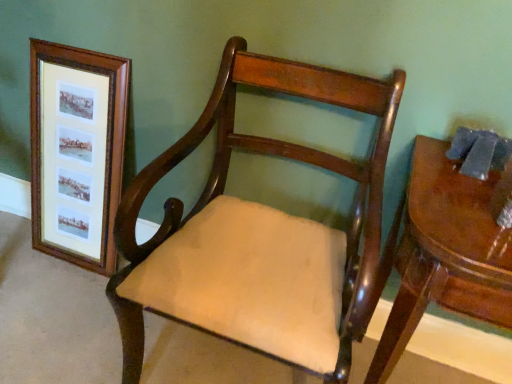
This screenshot has width=512, height=384. What do you see at coordinates (445, 253) in the screenshot? I see `glossy wood table at right` at bounding box center [445, 253].

What is the approximate width of wooden frame at left?

wooden frame at left is 2.32 inches in width.

Locate an element on the screen. This screenshot has width=512, height=384. mahogany wood chair at center is located at coordinates (262, 234).

What are the coordinates of `glossy wood table at right` in the screenshot? It's located at (445, 253).

From the image's perspective, would you say wooden frame at left is positioned over mahogany wood chair at center?

Yes, from the image's perspective, wooden frame at left is on top of mahogany wood chair at center.

Locate an element on the screen. The height and width of the screenshot is (384, 512). picture frame above the mahogany wood chair at center (from the image's perspective) is located at coordinates (77, 151).

Looking at the image, does wooden frame at left seem bigger or smaller compared to mahogany wood chair at center?

wooden frame at left is smaller than mahogany wood chair at center.

Are wooden frame at left and mahogany wood chair at center located far from each other?

No.

Considering the sizes of objects wooden frame at left and glossy wood table at right in the image provided, who is shorter, wooden frame at left or glossy wood table at right?

glossy wood table at right.

Which object is further away from the camera taking this photo, wooden frame at left or glossy wood table at right?

wooden frame at left is behind.

Visually, is wooden frame at left positioned to the left or to the right of glossy wood table at right?

Clearly, wooden frame at left is on the left of glossy wood table at right in the image.

Is glossy wood table at right located within wooden frame at left?

No, glossy wood table at right is not a part of wooden frame at left.

Identify the location of picture frame behind the mahogany wood chair at center. (77, 151).

Can you confirm if mahogany wood chair at center is bigger than wooden frame at left?

Correct, mahogany wood chair at center is larger in size than wooden frame at left.

Can you confirm if mahogany wood chair at center is shorter than wooden frame at left?

In fact, mahogany wood chair at center may be taller than wooden frame at left.

How different are the orientations of mahogany wood chair at center and wooden frame at left in degrees?

They differ by 0.869 degrees in their facing directions.

From the picture: From a real-world perspective, does glossy wood table at right sit lower than wooden frame at left?

Yes, from a real-world perspective, glossy wood table at right is below wooden frame at left.

In the image, there is a wooden frame at left. In order to click on table below it (from the image's perspective) in this screenshot , I will do `click(445, 253)`.

Between glossy wood table at right and wooden frame at left, which one has more height?

Standing taller between the two is wooden frame at left.

Is glossy wood table at right next to mahogany wood chair at center?

No, glossy wood table at right is not with mahogany wood chair at center.

In the image, there is a mahogany wood chair at center. Where is `table below it (from the image's perspective)`? Image resolution: width=512 pixels, height=384 pixels. table below it (from the image's perspective) is located at coordinates (445, 253).

Considering the positions of objects glossy wood table at right and mahogany wood chair at center in the image provided, who is behind, glossy wood table at right or mahogany wood chair at center?

Positioned behind is glossy wood table at right.

Considering the relative positions of glossy wood table at right and mahogany wood chair at center in the image provided, is glossy wood table at right to the left or to the right of mahogany wood chair at center?

glossy wood table at right is to the right of mahogany wood chair at center.

Measure the distance from mahogany wood chair at center to glossy wood table at right.

They are 9.54 inches apart.

Which is more to the right, mahogany wood chair at center or glossy wood table at right?

glossy wood table at right is more to the right.

Who is smaller, mahogany wood chair at center or glossy wood table at right?

glossy wood table at right.

Who is taller, mahogany wood chair at center or glossy wood table at right?

Standing taller between the two is mahogany wood chair at center.

Where is `chair that is on the right side of wooden frame at left`? This screenshot has width=512, height=384. chair that is on the right side of wooden frame at left is located at coordinates (262, 234).

I want to click on picture frame on the left side of glossy wood table at right, so (77, 151).

Based on their spatial positions, is glossy wood table at right or mahogany wood chair at center closer to wooden frame at left?

Among the two, mahogany wood chair at center is located nearer to wooden frame at left.

Looking at this image, considering their positions, is wooden frame at left positioned closer to glossy wood table at right than mahogany wood chair at center?

mahogany wood chair at center is closer to glossy wood table at right.

When comparing their distances from mahogany wood chair at center, does glossy wood table at right or wooden frame at left seem closer?

glossy wood table at right.

When comparing their distances from wooden frame at left, does mahogany wood chair at center or glossy wood table at right seem further?

The object further to wooden frame at left is glossy wood table at right.

Looking at the image, which one is located closer to glossy wood table at right, mahogany wood chair at center or wooden frame at left?

Based on the image, mahogany wood chair at center appears to be nearer to glossy wood table at right.

Based on their spatial positions, is wooden frame at left or glossy wood table at right further from mahogany wood chair at center?

Based on the image, wooden frame at left appears to be further to mahogany wood chair at center.

You are a GUI agent. You are given a task and a screenshot of the screen. Output one action in this format:
    pyautogui.click(x=<x>, y=<y>)
    Task: Click on the chair between wooden frame at left and glossy wood table at right from left to right
    This screenshot has width=512, height=384.
    Given the screenshot: What is the action you would take?
    pyautogui.click(x=262, y=234)